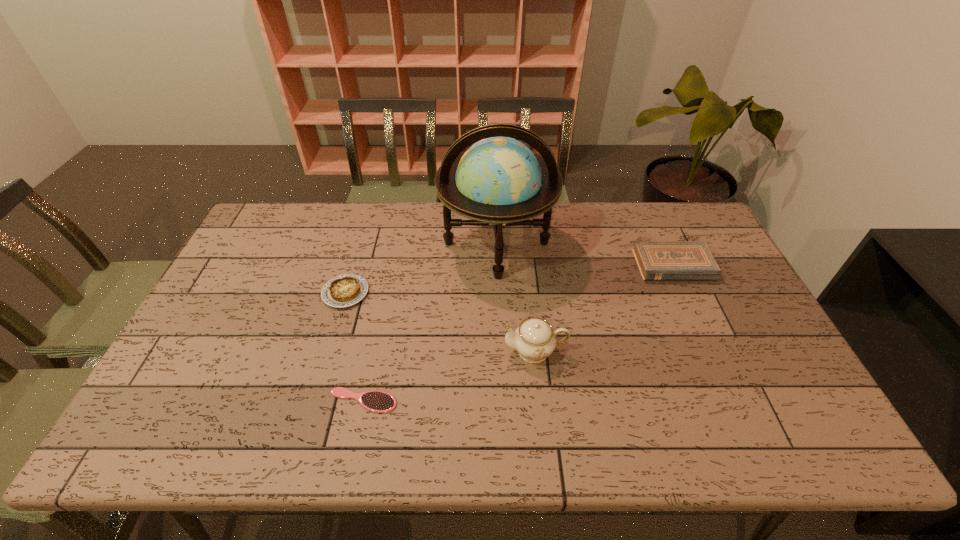
The height and width of the screenshot is (540, 960). I want to click on free space at the far left corner of the desktop, so click(x=268, y=201).

Locate an element on the screen. The image size is (960, 540). free space between the second shortest object and the third shortest object is located at coordinates (510, 279).

Find the location of a particular element. The height and width of the screenshot is (540, 960). blank region between the globe and the rightmost object is located at coordinates (585, 254).

Image resolution: width=960 pixels, height=540 pixels. What are the coordinates of `free space between the fourth tallest object and the fourth shortest object` in the screenshot? It's located at (441, 322).

Where is `vacant region between the second tallest object and the globe`? The image size is (960, 540). vacant region between the second tallest object and the globe is located at coordinates (516, 297).

What are the coordinates of `free space between the fourth tallest object and the tallest object` in the screenshot? It's located at 421,268.

You are a GUI agent. You are given a task and a screenshot of the screen. Output one action in this format:
    pyautogui.click(x=<x>, y=<y>)
    Task: Click on the vacant point located between the quiche and the Bible
    
    Given the screenshot: What is the action you would take?
    pyautogui.click(x=510, y=279)

You are a GUI agent. You are given a task and a screenshot of the screen. Output one action in this format:
    pyautogui.click(x=<x>, y=<y>)
    Task: Click on the unoccupied position between the hairbrush and the fourth tallest object
    The image size is (960, 540).
    Given the screenshot: What is the action you would take?
    pyautogui.click(x=354, y=347)

What are the coordinates of `free space that is in between the nearest object and the globe` in the screenshot? It's located at (430, 322).

Identify the location of empty space that is in between the nearest object and the fourth farthest object. (449, 375).